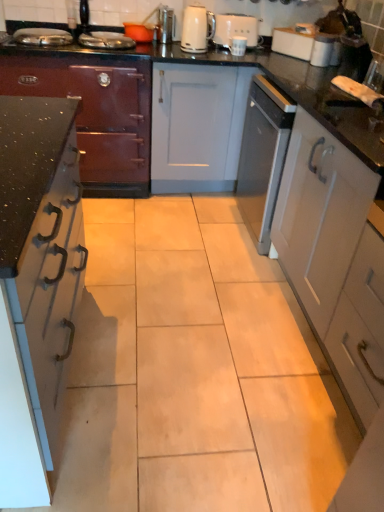
Identify the location of white glossy electric kettle at upper center. This screenshot has height=512, width=384. (197, 29).

Looking at this image, measure the distance between satin nickel toaster at upper center, the second appliance viewed from the left, and camera.

satin nickel toaster at upper center, the second appliance viewed from the left, is 2.65 meters from camera.

You are a GUI agent. You are given a task and a screenshot of the screen. Output one action in this format:
    pyautogui.click(x=<x>, y=<y>)
    Task: Click on the white glossy cabinet at right, which is the first cabinetry in right-to-left order
    This screenshot has height=512, width=384.
    Given the screenshot: What is the action you would take?
    pyautogui.click(x=331, y=257)

Describe the element at coordinates (96, 115) in the screenshot. This screenshot has width=384, height=512. I see `metallic dark gray stove at left, which is the third cabinetry in right-to-left order` at that location.

Image resolution: width=384 pixels, height=512 pixels. Describe the element at coordinates (139, 32) in the screenshot. I see `orange matte bowl at upper center, marked as the 1th appliance in a left-to-right arrangement` at that location.

What do you see at coordinates (236, 30) in the screenshot? The width and height of the screenshot is (384, 512). I see `white matte coffee machine at upper center` at bounding box center [236, 30].

Locate an element on the screen. white matte coffee machine at upper center is located at coordinates (236, 30).

Locate an element on the screen. black glossy countertop at center is located at coordinates (276, 83).

This screenshot has height=512, width=384. I want to click on white glossy electric kettle at upper center, so click(197, 29).

Is white matte coffee machine at upper center completely or partially outside of satin nickel toaster at upper center, marked as the 1th appliance in a right-to-left arrangement?

Yes, white matte coffee machine at upper center is outside of satin nickel toaster at upper center, marked as the 1th appliance in a right-to-left arrangement.

Which is closer to the camera, (256, 36) or (158, 19)?

The point (158, 19) is more forward.

Looking at their sizes, would you say white matte coffee machine at upper center is wider or thinner than satin nickel toaster at upper center, the second appliance viewed from the left?

In the image, white matte coffee machine at upper center appears to be wider than satin nickel toaster at upper center, the second appliance viewed from the left.

Which is nearer, (41, 91) or (185, 37)?

Point (41, 91) is positioned closer to the camera compared to point (185, 37).

Is metallic dark gray stove at left, which is the third cabinetry in right-to-left order, touching white glossy electric kettle at upper center?

No, metallic dark gray stove at left, which is the third cabinetry in right-to-left order, is not making contact with white glossy electric kettle at upper center.

Considering the relative sizes of metallic dark gray stove at left, which is the third cabinetry in right-to-left order, and white glossy electric kettle at upper center in the image provided, is metallic dark gray stove at left, which is the third cabinetry in right-to-left order, bigger than white glossy electric kettle at upper center?

Correct, metallic dark gray stove at left, which is the third cabinetry in right-to-left order, is larger in size than white glossy electric kettle at upper center.

In the image, is metallic dark gray stove at left, placed as the 1th cabinetry when sorted from left to right, on the left side or the right side of white glossy electric kettle at upper center?

metallic dark gray stove at left, placed as the 1th cabinetry when sorted from left to right, is to the left of white glossy electric kettle at upper center.

Does white glossy cabinet at right, which is the first cabinetry in right-to-left order, turn towards black speckled countertop at left, acting as the 2th cabinetry starting from the left?

Yes, white glossy cabinet at right, which is the first cabinetry in right-to-left order, is facing black speckled countertop at left, acting as the 2th cabinetry starting from the left.

Which is in front, point (285, 195) or point (31, 218)?

The point (31, 218) is closer.

Does white glossy cabinet at right, which is the first cabinetry in right-to-left order, have a smaller size compared to black speckled countertop at left, the 2th cabinetry in the right-to-left sequence?

Yes, white glossy cabinet at right, which is the first cabinetry in right-to-left order, is smaller than black speckled countertop at left, the 2th cabinetry in the right-to-left sequence.

Does point (170, 39) come behind point (4, 414)?

That is True.

You are a GUI agent. You are given a task and a screenshot of the screen. Output one action in this format:
    pyautogui.click(x=<x>, y=<y>)
    Task: Click on the 2nd appliance behind the black speckled countertop at left, the 2th cabinetry in the right-to-left sequence, starting your count from the anchor
    The height and width of the screenshot is (512, 384).
    Given the screenshot: What is the action you would take?
    pyautogui.click(x=165, y=24)

Who is bigger, satin nickel toaster at upper center, marked as the 1th appliance in a right-to-left arrangement, or black speckled countertop at left, acting as the 2th cabinetry starting from the left?

black speckled countertop at left, acting as the 2th cabinetry starting from the left.

From a real-world perspective, is satin nickel toaster at upper center, marked as the 1th appliance in a right-to-left arrangement, physically above black speckled countertop at left, acting as the 2th cabinetry starting from the left?

Yes.

Is black glossy countertop at center thinner than white glossy electric kettle at upper center?

No.

Considering the positions of objects black glossy countertop at center and white glossy electric kettle at upper center in the image provided, who is more to the left, black glossy countertop at center or white glossy electric kettle at upper center?

white glossy electric kettle at upper center.

Does black glossy countertop at center have a smaller size compared to white glossy electric kettle at upper center?

Incorrect, black glossy countertop at center is not smaller in size than white glossy electric kettle at upper center.

Is white glossy electric kettle at upper center at the back of black glossy countertop at center?

black glossy countertop at center does not have its back to white glossy electric kettle at upper center.

Is white glossy electric kettle at upper center aimed at black speckled countertop at left, the 2th cabinetry in the right-to-left sequence?

No.

From a real-world perspective, does white glossy electric kettle at upper center sit lower than black speckled countertop at left, acting as the 2th cabinetry starting from the left?

No, from a real-world perspective, white glossy electric kettle at upper center is not beneath black speckled countertop at left, acting as the 2th cabinetry starting from the left.

From the image's perspective, does white glossy electric kettle at upper center appear higher than black speckled countertop at left, the 2th cabinetry in the right-to-left sequence?

Indeed, from the image's perspective, white glossy electric kettle at upper center is shown above black speckled countertop at left, the 2th cabinetry in the right-to-left sequence.

How much distance is there between black speckled countertop at left, acting as the 2th cabinetry starting from the left, and metallic dark gray stove at left, which is the third cabinetry in right-to-left order?

They are 4.03 feet apart.

Does black speckled countertop at left, acting as the 2th cabinetry starting from the left, have a lesser height compared to metallic dark gray stove at left, which is the third cabinetry in right-to-left order?

Indeed, black speckled countertop at left, acting as the 2th cabinetry starting from the left, has a lesser height compared to metallic dark gray stove at left, which is the third cabinetry in right-to-left order.

Looking at the image, does black speckled countertop at left, acting as the 2th cabinetry starting from the left, seem bigger or smaller compared to metallic dark gray stove at left, which is the third cabinetry in right-to-left order?

In the image, black speckled countertop at left, acting as the 2th cabinetry starting from the left, appears to be smaller than metallic dark gray stove at left, which is the third cabinetry in right-to-left order.

Where is `the 1st appliance to the left of the white matte coffee machine at upper center, starting your count from the anchor`? This screenshot has height=512, width=384. the 1st appliance to the left of the white matte coffee machine at upper center, starting your count from the anchor is located at coordinates (165, 24).

Identify the location of the 1st cabinetry below the white glossy electric kettle at upper center (from the image's perspective). (96, 115).

In the scene shown: Looking at the image, which one is located closer to white glossy cabinet at right, which is the first cabinetry in right-to-left order, satin nickel toaster at upper center, the second appliance viewed from the left, or black glossy countertop at center?

black glossy countertop at center.

Based on their spatial positions, is white matte coffee machine at upper center or orange matte bowl at upper center, the second appliance when ordered from right to left, further from black glossy countertop at center?

Among the two, orange matte bowl at upper center, the second appliance when ordered from right to left, is located further to black glossy countertop at center.

Considering their positions, is metallic dark gray stove at left, placed as the 1th cabinetry when sorted from left to right, positioned further to black glossy countertop at center than white glossy cabinet at right, the third cabinetry from the left?

Among the two, metallic dark gray stove at left, placed as the 1th cabinetry when sorted from left to right, is located further to black glossy countertop at center.

Considering their positions, is orange matte bowl at upper center, marked as the 1th appliance in a left-to-right arrangement, positioned closer to white glossy electric kettle at upper center than white glossy cabinet at right, which is the first cabinetry in right-to-left order?

orange matte bowl at upper center, marked as the 1th appliance in a left-to-right arrangement, lies closer to white glossy electric kettle at upper center than the other object.

Based on their spatial positions, is white matte coffee machine at upper center or black speckled countertop at left, acting as the 2th cabinetry starting from the left, further from metallic dark gray stove at left, which is the third cabinetry in right-to-left order?

black speckled countertop at left, acting as the 2th cabinetry starting from the left, is positioned further to the anchor metallic dark gray stove at left, which is the third cabinetry in right-to-left order.

Consider the image. Looking at the image, which one is located closer to satin nickel toaster at upper center, marked as the 1th appliance in a right-to-left arrangement, white glossy electric kettle at upper center or black speckled countertop at left, the 2th cabinetry in the right-to-left sequence?

white glossy electric kettle at upper center is positioned closer to the anchor satin nickel toaster at upper center, marked as the 1th appliance in a right-to-left arrangement.

Considering their positions, is black glossy countertop at center positioned closer to metallic dark gray stove at left, which is the third cabinetry in right-to-left order, than satin nickel toaster at upper center, the second appliance viewed from the left?

The object closer to metallic dark gray stove at left, which is the third cabinetry in right-to-left order, is satin nickel toaster at upper center, the second appliance viewed from the left.

Looking at the image, which one is located closer to black glossy countertop at center, metallic dark gray stove at left, placed as the 1th cabinetry when sorted from left to right, or white glossy electric kettle at upper center?

The object closer to black glossy countertop at center is white glossy electric kettle at upper center.

The height and width of the screenshot is (512, 384). Find the location of `countertop between white glossy cabinet at right, which is the first cabinetry in right-to-left order, and orange matte bowl at upper center, the second appliance when ordered from right to left, along the z-axis`. countertop between white glossy cabinet at right, which is the first cabinetry in right-to-left order, and orange matte bowl at upper center, the second appliance when ordered from right to left, along the z-axis is located at coordinates (276, 83).

I want to click on countertop located between black speckled countertop at left, the 2th cabinetry in the right-to-left sequence, and orange matte bowl at upper center, marked as the 1th appliance in a left-to-right arrangement, in the depth direction, so click(276, 83).

Find the location of a particular element. kitchen appliance that lies between orange matte bowl at upper center, the second appliance when ordered from right to left, and white glossy cabinet at right, which is the first cabinetry in right-to-left order, from top to bottom is located at coordinates (197, 29).

This screenshot has height=512, width=384. Find the location of `countertop between metallic dark gray stove at left, which is the third cabinetry in right-to-left order, and white glossy cabinet at right, the third cabinetry from the left, in the horizontal direction`. countertop between metallic dark gray stove at left, which is the third cabinetry in right-to-left order, and white glossy cabinet at right, the third cabinetry from the left, in the horizontal direction is located at coordinates (276, 83).